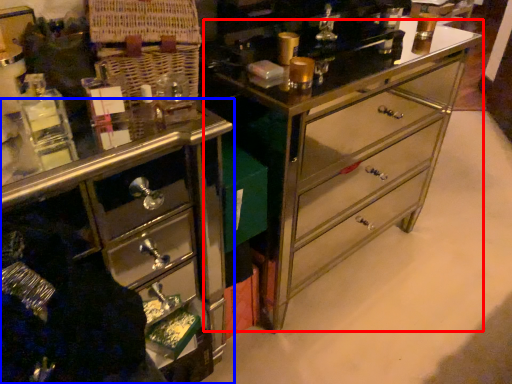
Question: Among these objects, which one is nearest to the camera, counter (highlighted by a red box) or chest of drawers (highlighted by a blue box)?

Choices:
 (A) counter
 (B) chest of drawers

Answer: (B)